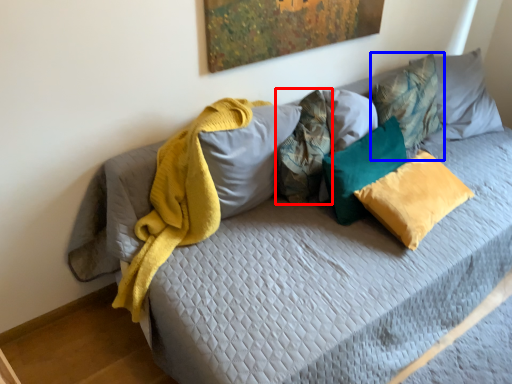
Question: Which object appears closest to the camera in this image, pillow (highlighted by a red box) or pillow (highlighted by a blue box)?

Choices:
 (A) pillow
 (B) pillow

Answer: (A)